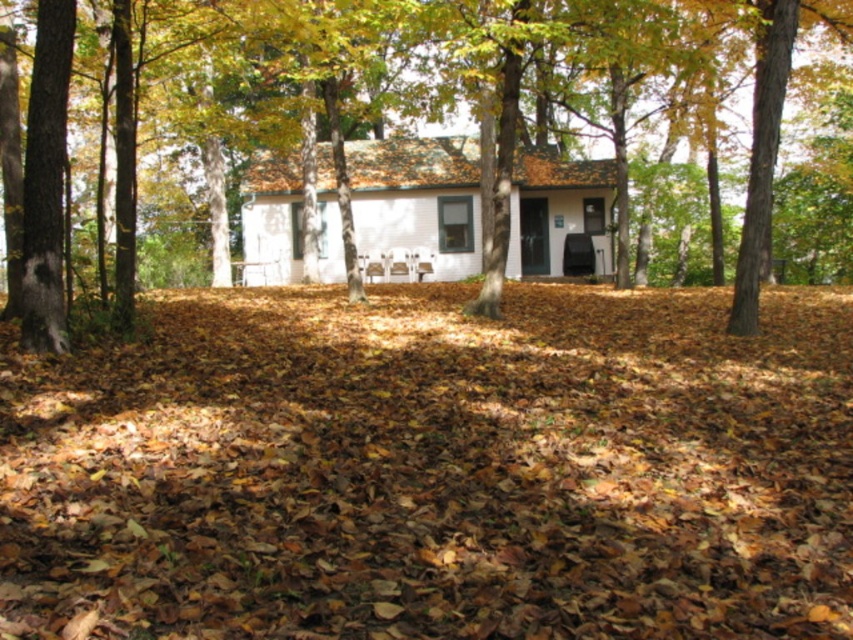
Question: Where is brown leaf litter at center located in relation to brown wood tree at center in the image?

Choices:
 (A) above
 (B) below

Answer: (B)

Question: Is brown leaf litter at center wider than brown wood tree at center?

Choices:
 (A) yes
 (B) no

Answer: (B)

Question: Which point appears farthest from the camera in this image?

Choices:
 (A) (756, 204)
 (B) (123, 536)

Answer: (A)

Question: Does brown leaf litter at center have a lesser width compared to brown wood tree at center?

Choices:
 (A) yes
 (B) no

Answer: (A)